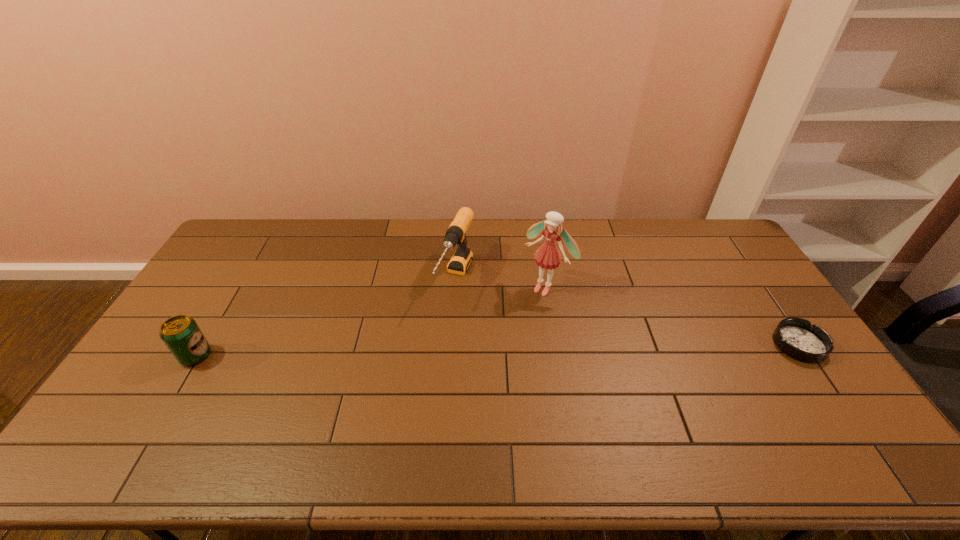
Where is `vacant space on the desktop that is between the second shortest object and the ashtray and is positioned on the front-facing side of the third object from left to right`? The height and width of the screenshot is (540, 960). vacant space on the desktop that is between the second shortest object and the ashtray and is positioned on the front-facing side of the third object from left to right is located at coordinates (488, 350).

In order to click on vacant space on the desktop that is between the beer can and the ashtray and is positioned on the handle side of the drill in this screenshot , I will do `click(420, 352)`.